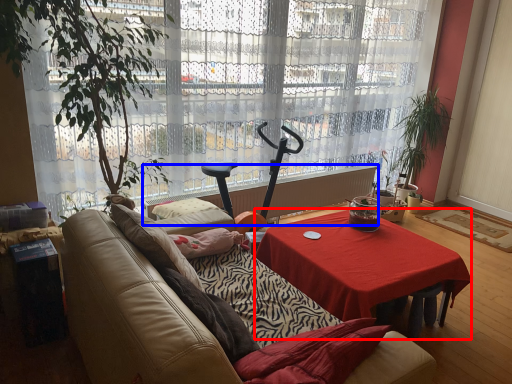
Question: Which object is closer to the camera taking this photo, desk (highlighted by a red box) or radiator (highlighted by a blue box)?

Choices:
 (A) desk
 (B) radiator

Answer: (A)